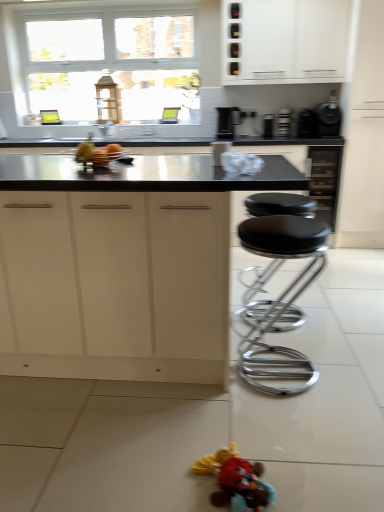
Measure the distance between point (324,22) and camera.

3.27 meters.

What do you see at coordinates (329, 117) in the screenshot? The image size is (384, 512). I see `black matte coffee maker at upper right, which is counted as the first appliance, starting from the right` at bounding box center [329, 117].

You are a GUI agent. You are given a task and a screenshot of the screen. Output one action in this format:
    pyautogui.click(x=<x>, y=<y>)
    Task: Click on the black chrome stool at center
    
    Given the screenshot: What is the action you would take?
    pos(280,302)

The image size is (384, 512). What do you see at coordinates (236, 481) in the screenshot?
I see `plush fabric toy at lower center` at bounding box center [236, 481].

Find the location of a particular element. This screenshot has height=512, width=384. black plastic toaster at upper center, which appears as the third appliance when viewed from the right is located at coordinates (284, 122).

Consider the image. Does black plastic toaster at upper right, acting as the 4th appliance starting from the left, turn towards matte white cabinets at center, which is the 2th cabinetry from back to front?

No, black plastic toaster at upper right, acting as the 4th appliance starting from the left, is not facing towards matte white cabinets at center, which is the 2th cabinetry from back to front.

Can you tell me how much black plastic toaster at upper right, which appears as the 2th appliance when viewed from the right, and matte white cabinets at center, the second cabinetry when ordered from right to left, differ in facing direction?

The angular difference between black plastic toaster at upper right, which appears as the 2th appliance when viewed from the right, and matte white cabinets at center, the second cabinetry when ordered from right to left, is 91 degrees.

From the image's perspective, does black plastic toaster at upper right, acting as the 4th appliance starting from the left, appear higher than matte white cabinets at center, marked as the 2th cabinetry in a top-to-bottom arrangement?

Yes.

Looking at this image, which object is further away from the camera taking this photo, black plastic toaster at upper right, acting as the 4th appliance starting from the left, or matte white cabinets at center, which is the first cabinetry from bottom to top?

black plastic toaster at upper right, acting as the 4th appliance starting from the left, is behind.

Based on the photo, how different are the orientations of black matte coffee maker at upper right, the fifth appliance viewed from the left, and black plastic toaster at upper right, which appears as the 2th appliance when viewed from the right, in degrees?

They differ by 7.56e-05 degrees in their facing directions.

From the picture: Is black matte coffee maker at upper right, the fifth appliance viewed from the left, completely or partially outside of black plastic toaster at upper right, which appears as the 2th appliance when viewed from the right?

black matte coffee maker at upper right, the fifth appliance viewed from the left, lies outside black plastic toaster at upper right, which appears as the 2th appliance when viewed from the right,'s area.

Is black matte coffee maker at upper right, which is counted as the first appliance, starting from the right, further to the viewer compared to black plastic toaster at upper right, acting as the 4th appliance starting from the left?

No, it is in front of black plastic toaster at upper right, acting as the 4th appliance starting from the left.

Which object is wider, black matte coffee maker at upper right, which is counted as the first appliance, starting from the right, or black plastic toaster at upper right, which appears as the 2th appliance when viewed from the right?

black matte coffee maker at upper right, which is counted as the first appliance, starting from the right, is wider.

Based on the photo, considering the relative sizes of black plastic coffee machine at upper center and black matte coffee maker at upper right, which is counted as the first appliance, starting from the right, in the image provided, is black plastic coffee machine at upper center wider than black matte coffee maker at upper right, which is counted as the first appliance, starting from the right,?

Incorrect, the width of black plastic coffee machine at upper center does not surpass that of black matte coffee maker at upper right, which is counted as the first appliance, starting from the right.

Is black plastic coffee machine at upper center facing towards black matte coffee maker at upper right, the fifth appliance viewed from the left?

No, black plastic coffee machine at upper center is not turned towards black matte coffee maker at upper right, the fifth appliance viewed from the left.

Are black plastic coffee machine at upper center and black matte coffee maker at upper right, which is counted as the first appliance, starting from the right, beside each other?

No, black plastic coffee machine at upper center is not in contact with black matte coffee maker at upper right, which is counted as the first appliance, starting from the right.

Considering the sizes of objects white matte cabinet at upper center, the second cabinetry viewed from the left, and plush fabric toy at lower center in the image provided, who is bigger, white matte cabinet at upper center, the second cabinetry viewed from the left, or plush fabric toy at lower center?

white matte cabinet at upper center, the second cabinetry viewed from the left, is bigger.

Does white matte cabinet at upper center, arranged as the 1th cabinetry when viewed from the top, come in front of plush fabric toy at lower center?

No, the depth of white matte cabinet at upper center, arranged as the 1th cabinetry when viewed from the top, is greater than that of plush fabric toy at lower center.

Considering the relative sizes of white matte cabinet at upper center, which is counted as the 2th cabinetry, starting from the bottom, and plush fabric toy at lower center in the image provided, is white matte cabinet at upper center, which is counted as the 2th cabinetry, starting from the bottom, wider than plush fabric toy at lower center?

Yes.

Which object is positioned more to the left, black plastic coffee machine at upper center or matte white cabinets at center, the second cabinetry when ordered from right to left?

matte white cabinets at center, the second cabinetry when ordered from right to left, is more to the left.

Between black plastic coffee machine at upper center and matte white cabinets at center, the second cabinetry when ordered from right to left, which one has more height?

With more height is matte white cabinets at center, the second cabinetry when ordered from right to left.

Between black plastic coffee machine at upper center and matte white cabinets at center, the second cabinetry when ordered from right to left, which one has smaller size?

black plastic coffee machine at upper center.

Consider the image. Is plush fabric toy at lower center not within black plastic toaster at upper right, which appears as the 2th appliance when viewed from the right?

Absolutely, plush fabric toy at lower center is external to black plastic toaster at upper right, which appears as the 2th appliance when viewed from the right.

Which of these two, plush fabric toy at lower center or black plastic toaster at upper right, acting as the 4th appliance starting from the left, is wider?

Wider between the two is black plastic toaster at upper right, acting as the 4th appliance starting from the left.

Could you measure the distance between plush fabric toy at lower center and black plastic toaster at upper right, which appears as the 2th appliance when viewed from the right?

plush fabric toy at lower center and black plastic toaster at upper right, which appears as the 2th appliance when viewed from the right, are 2.76 meters apart from each other.

Is point (248, 478) positioned in front of point (310, 115)?

Yes, point (248, 478) is closer to viewer.

Between black matte coffee maker at upper right, the fifth appliance viewed from the left, and plush fabric toy at lower center, which one has larger width?

With larger width is black matte coffee maker at upper right, the fifth appliance viewed from the left.

Could you tell me if black matte coffee maker at upper right, the fifth appliance viewed from the left, is turned towards plush fabric toy at lower center?

No, black matte coffee maker at upper right, the fifth appliance viewed from the left, is not turned towards plush fabric toy at lower center.

Which object is further away from the camera, black matte coffee maker at upper right, the fifth appliance viewed from the left, or plush fabric toy at lower center?

black matte coffee maker at upper right, the fifth appliance viewed from the left, is behind.

Starting from the matte white cabinets at center, marked as the 2th cabinetry in a top-to-bottom arrangement, which appliance is the 2nd one behind? Please provide its 2D coordinates.

[(307, 124)]

From a real-world perspective, starting from the black plastic toaster at upper right, acting as the 4th appliance starting from the left, which appliance is the 3rd one vertically above it? Please provide its 2D coordinates.

[(329, 117)]

From the image, which object appears to be farther from black matte coffee maker at upper right, the fifth appliance viewed from the left, matte white cabinets at center, which is the 2th cabinetry from back to front, or white matte cabinet at upper center, the first cabinetry in the right-to-left sequence?

Among the two, matte white cabinets at center, which is the 2th cabinetry from back to front, is located further to black matte coffee maker at upper right, the fifth appliance viewed from the left.

Based on their spatial positions, is black plastic toaster at upper center, the fourth appliance from the right, or black plastic toaster at upper right, which appears as the 2th appliance when viewed from the right, further from black chrome stool at center?

black plastic toaster at upper center, the fourth appliance from the right.

Considering their positions, is plush fabric toy at lower center positioned further to white matte cabinet at upper center, arranged as the 1th cabinetry when viewed from the top, than black chrome stool at center?

Based on the image, plush fabric toy at lower center appears to be further to white matte cabinet at upper center, arranged as the 1th cabinetry when viewed from the top.

When comparing their distances from black plastic toaster at upper center, placed as the 2th appliance when sorted from left to right, does black matte coffee maker at upper right, the fifth appliance viewed from the left, or metallic silver laptop at center, the 1th appliance from the left, seem further?

metallic silver laptop at center, the 1th appliance from the left, is further to black plastic toaster at upper center, placed as the 2th appliance when sorted from left to right.

From the image, which object appears to be nearer to black plastic toaster at upper center, which appears as the third appliance when viewed from the right, black plastic coffee machine at upper center or black chrome stool at center?

black plastic coffee machine at upper center is closer to black plastic toaster at upper center, which appears as the third appliance when viewed from the right.

Considering their positions, is black plastic toaster at upper center, which is the 3th appliance in left-to-right order, positioned further to metallic silver laptop at center, the 1th appliance from the left, than black plastic toaster at upper center, the fourth appliance from the right?

black plastic toaster at upper center, which is the 3th appliance in left-to-right order, lies further to metallic silver laptop at center, the 1th appliance from the left, than the other object.

When comparing their distances from black plastic toaster at upper center, the fourth appliance from the right, does black plastic toaster at upper right, which appears as the 2th appliance when viewed from the right, or black plastic coffee machine at upper center seem further?

Among the two, black plastic coffee machine at upper center is located further to black plastic toaster at upper center, the fourth appliance from the right.

Looking at the image, which one is located closer to black plastic coffee machine at upper center, white matte cabinet at upper center, the 2th cabinetry positioned from the front, or black chrome stool at center?

white matte cabinet at upper center, the 2th cabinetry positioned from the front, lies closer to black plastic coffee machine at upper center than the other object.

I want to click on coffee machine between matte white cabinets at center, the second cabinetry when ordered from right to left, and black plastic toaster at upper center, placed as the 2th appliance when sorted from left to right, from front to back, so click(x=231, y=121).

At what (x,y) coordinates should I click in order to perform the action: click on coffee machine between matte white cabinets at center, placed as the first cabinetry when sorted from left to right, and metallic silver laptop at center, which is counted as the 5th appliance, starting from the right, from front to back. Please return your answer as a coordinate pair (x, y). The height and width of the screenshot is (512, 384). Looking at the image, I should click on click(x=231, y=121).

Locate an element on the screen. stool between white matte cabinet at upper center, the second cabinetry viewed from the left, and plush fabric toy at lower center, in the vertical direction is located at coordinates (280, 302).

Locate an element on the screen. Image resolution: width=384 pixels, height=512 pixels. coffee machine between white matte cabinet at upper center, the second cabinetry viewed from the left, and black plastic toaster at upper center, the fourth appliance from the right, in the up-down direction is located at coordinates (231, 121).